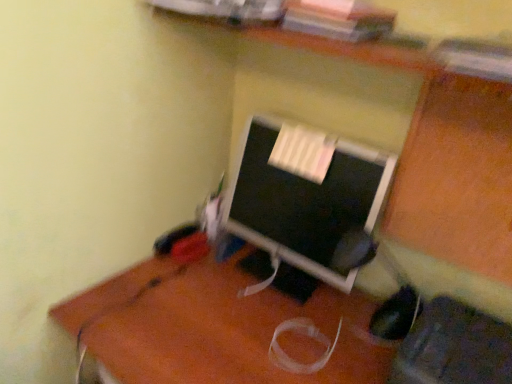
You are a GUI agent. You are given a task and a screenshot of the screen. Output one action in this format:
    pyautogui.click(x=<x>, y=<y>)
    Task: Click on the blank space to the left of matte black monitor at center
    This screenshot has height=384, width=512.
    Given the screenshot: What is the action you would take?
    198,285